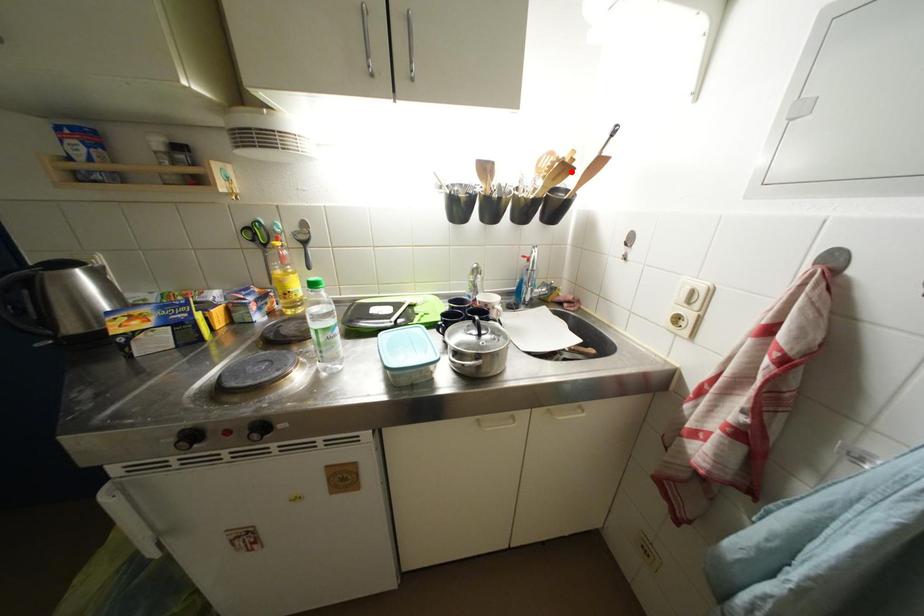
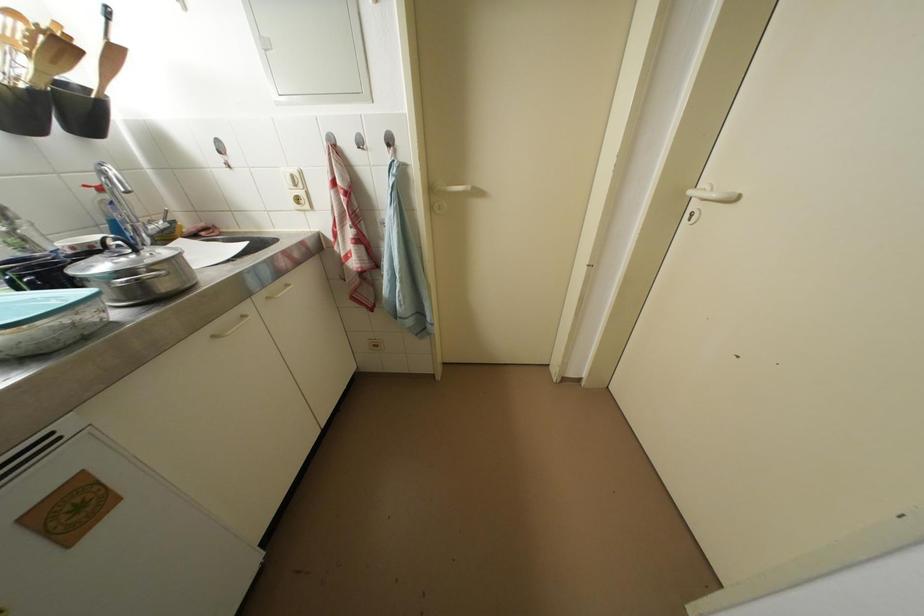
Question: A red point is marked in image1. In image2, is the corresponding 3D point closer to the camera or farther? Reply with the corresponding letter.

Choices:
 (A) The corresponding 3D point is closer.
 (B) The corresponding 3D point is farther.

Answer: (B)